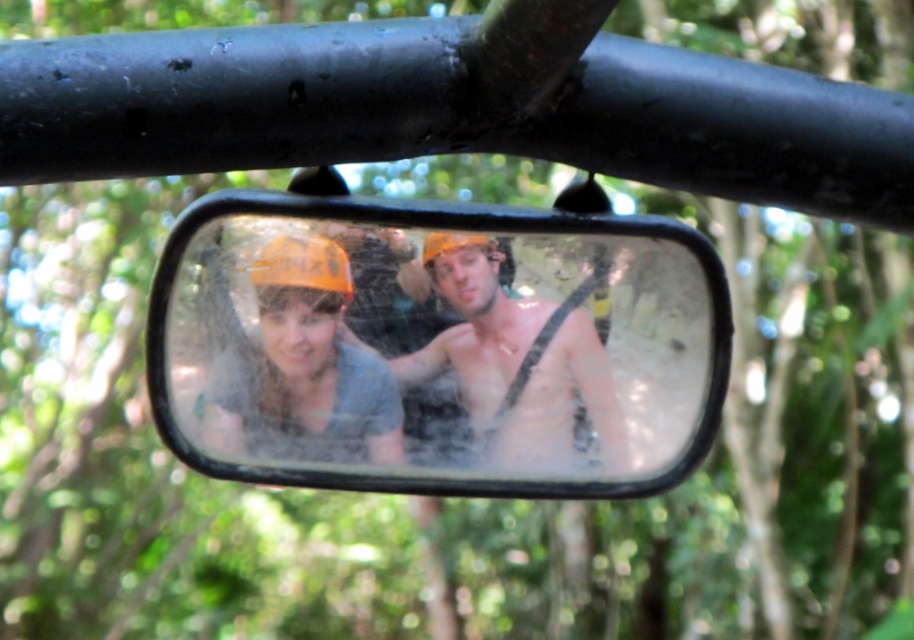
Is shiny silver helmet at center closer to camera compared to orange matte helmet at center?

No, it is not.

Does shiny silver helmet at center have a greater height compared to orange matte helmet at center?

Indeed, shiny silver helmet at center has a greater height compared to orange matte helmet at center.

The height and width of the screenshot is (640, 914). In order to click on shiny silver helmet at center in this screenshot , I will do `click(515, 362)`.

In order to click on shiny silver helmet at center in this screenshot , I will do `click(515, 362)`.

Is the position of clear glass mirror at center less distant than that of shiny silver helmet at center?

Yes.

This screenshot has height=640, width=914. What do you see at coordinates (436, 346) in the screenshot?
I see `clear glass mirror at center` at bounding box center [436, 346].

You are a GUI agent. You are given a task and a screenshot of the screen. Output one action in this format:
    pyautogui.click(x=<x>, y=<y>)
    Task: Click on the clear glass mirror at center
    The height and width of the screenshot is (640, 914).
    Given the screenshot: What is the action you would take?
    [x=436, y=346]

Is clear glass mirror at center to the right of orange matte helmet at center from the viewer's perspective?

Correct, you'll find clear glass mirror at center to the right of orange matte helmet at center.

Between clear glass mirror at center and orange matte helmet at center, which one is positioned lower?

Positioned lower is orange matte helmet at center.

At what (x,y) coordinates should I click in order to perform the action: click on clear glass mirror at center. Please return your answer as a coordinate pair (x, y). The height and width of the screenshot is (640, 914). Looking at the image, I should click on (436, 346).